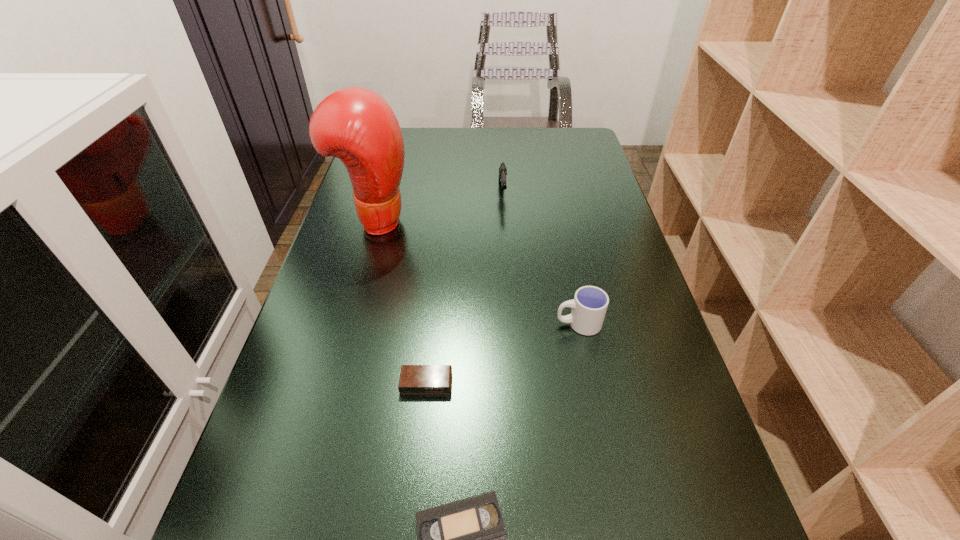
This screenshot has width=960, height=540. I want to click on unoccupied position between the boxing glove and the second object from right to left, so click(x=439, y=206).

The height and width of the screenshot is (540, 960). Find the location of `vacant space that's between the third farthest object and the boxing glove`. vacant space that's between the third farthest object and the boxing glove is located at coordinates (477, 272).

The height and width of the screenshot is (540, 960). In order to click on free space between the cup and the tallest object in this screenshot , I will do `click(477, 272)`.

Find the location of a particular element. The image size is (960, 540). object that can be found as the fourth closest to the fourth farthest object is located at coordinates (502, 169).

The image size is (960, 540). I want to click on the fourth closest object relative to the leftmost object, so click(x=466, y=539).

The image size is (960, 540). In order to click on free location that satisfies the following two spatial constraints: 1. at the end of the barrel of the second object from right to left; 2. on the striking surface of the leftmost object in this screenshot , I will do `click(504, 220)`.

Where is `free space that satisfies the following two spatial constraints: 1. at the end of the barrel of the gun; 2. on the striking surface of the boxing glove`? The image size is (960, 540). free space that satisfies the following two spatial constraints: 1. at the end of the barrel of the gun; 2. on the striking surface of the boxing glove is located at coordinates (504, 220).

This screenshot has width=960, height=540. Identify the location of vacant space that satisfies the following two spatial constraints: 1. at the end of the barrel of the gun; 2. on the striking surface of the tallest object. (504, 220).